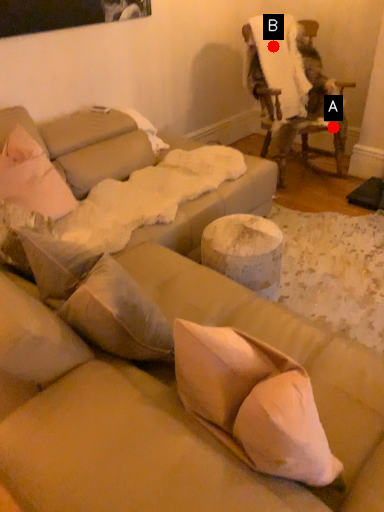
Question: Two points are circled on the image, labeled by A and B beside each circle. Which point is further to the camera?

Choices:
 (A) A is further
 (B) B is further

Answer: (A)